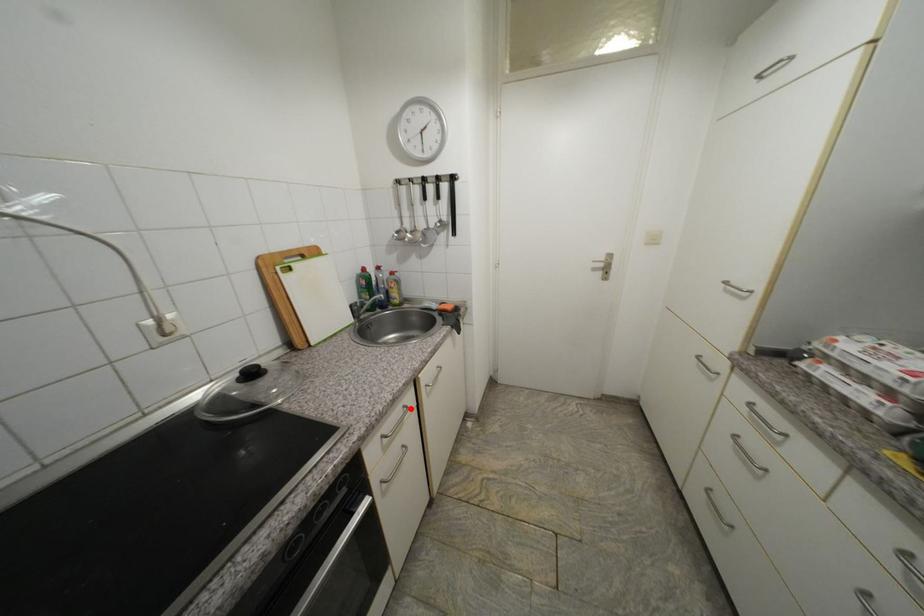
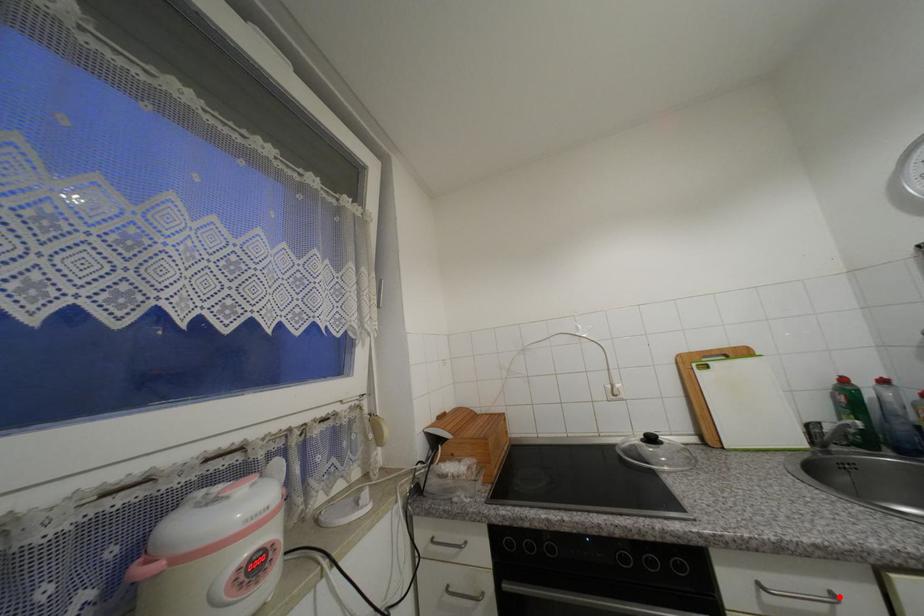
I am providing you with two images of the same scene from different viewpoints. A red point is marked on the first image and another point is marked on the second image. Is the red point in image1 aligned with the point shown in image2?

Yes